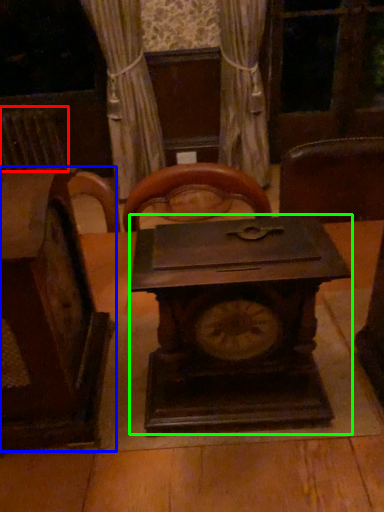
Question: Considering the real-world distances, which object is farthest from radiator (highlighted by a red box)? furniture (highlighted by a blue box) or clock (highlighted by a green box)?

Choices:
 (A) furniture
 (B) clock

Answer: (B)